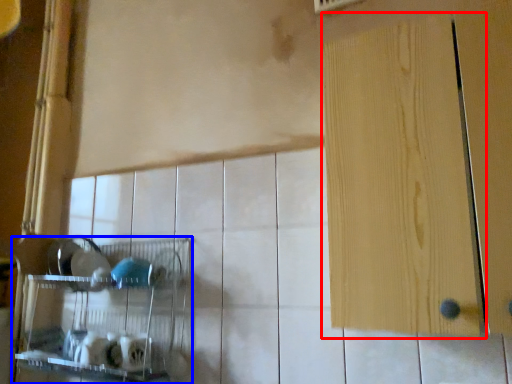
Question: Among these objects, which one is farthest to the camera, door (highlighted by a red box) or shelf (highlighted by a blue box)?

Choices:
 (A) door
 (B) shelf

Answer: (B)